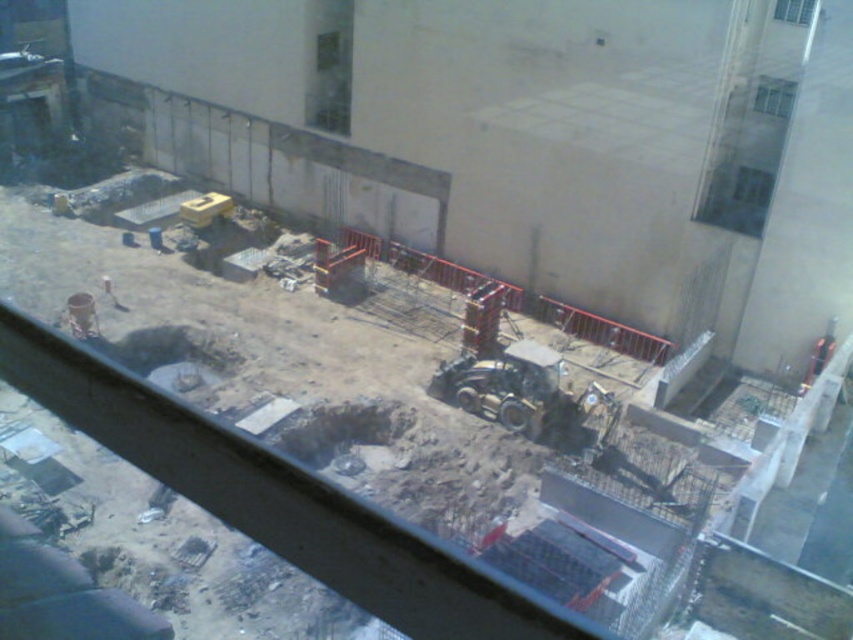
Question: Which object appears farthest from the camera in this image?

Choices:
 (A) clear glass window at upper right
 (B) metallic yellow tractor at center
 (C) transparent glass window at upper right

Answer: (B)

Question: Can you confirm if metallic yellow tractor at center is thinner than transparent glass window at upper center?

Choices:
 (A) no
 (B) yes

Answer: (B)

Question: Which object is positioned closest to the clear glass window at upper right?

Choices:
 (A) transparent glass window at upper center
 (B) transparent glass window at upper right

Answer: (B)

Question: Does transparent glass window at upper center come in front of clear glass window at upper right?

Choices:
 (A) yes
 (B) no

Answer: (B)

Question: Can you confirm if metallic yellow tractor at center is positioned to the right of transparent glass window at upper center?

Choices:
 (A) no
 (B) yes

Answer: (B)

Question: Which of these objects is positioned closest to the transparent glass window at upper center?

Choices:
 (A) clear glass window at upper right
 (B) transparent glass window at upper right

Answer: (A)